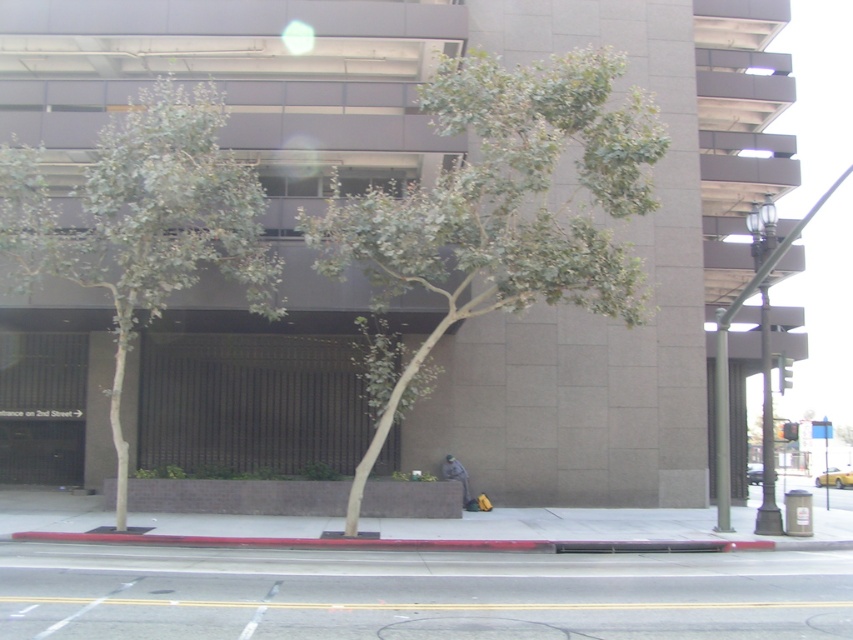
From the picture: You are standing at point (503,205) in this urban scene. What object are you directly at?

You are directly at the green leafy tree at center located at point (503,205).

Looking at this image, you are a city planner assessing the space in front of the building. You need to determine if there is enough room to install a new bench that requires 2 square meters of clear space. Based on the image, can the gray asphalt at lower center accommodate the bench without encroaching on the green leafy tree at left?

The gray asphalt at lower center is bigger than the green leafy tree at left, so it likely has sufficient space to accommodate the bench without encroaching on the tree.